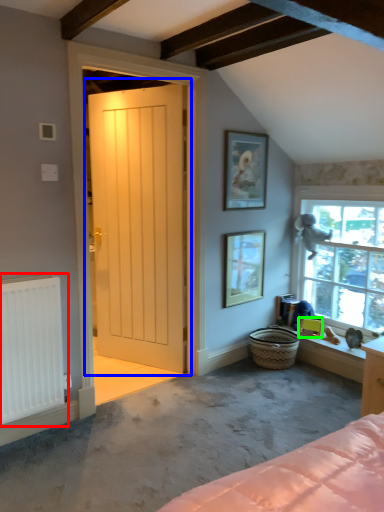
Question: Based on their relative distances, which object is nearer to radiator (highlighted by a red box)? Choose from door (highlighted by a blue box) and picture frame (highlighted by a green box).

Choices:
 (A) door
 (B) picture frame

Answer: (A)